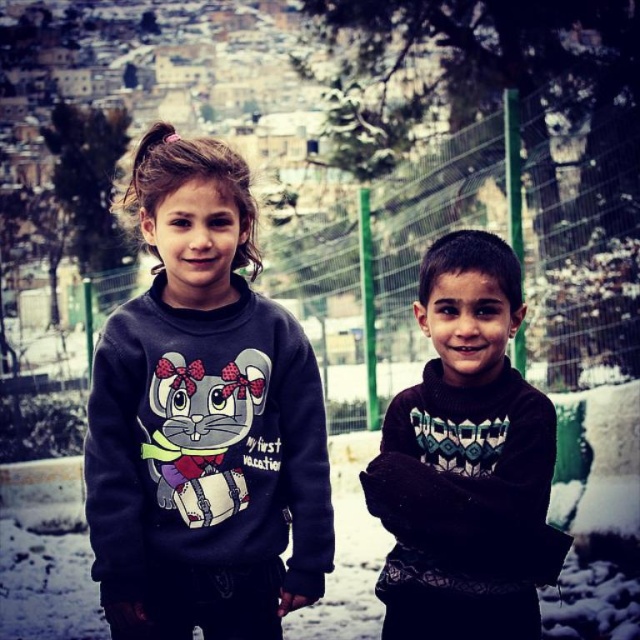
Question: Among these objects, which one is farthest from the camera?

Choices:
 (A) matte dark blue sweatshirt at center
 (B) black knitted sweater at right

Answer: (B)

Question: Is matte dark blue sweatshirt at center to the right of black knitted sweater at right from the viewer's perspective?

Choices:
 (A) yes
 (B) no

Answer: (B)

Question: Does matte dark blue sweatshirt at center have a larger size compared to black knitted sweater at right?

Choices:
 (A) no
 (B) yes

Answer: (B)

Question: Which point appears farthest from the camera in this image?

Choices:
 (A) (426, 326)
 (B) (182, 500)

Answer: (A)

Question: Is matte dark blue sweatshirt at center further to camera compared to black knitted sweater at right?

Choices:
 (A) no
 (B) yes

Answer: (A)